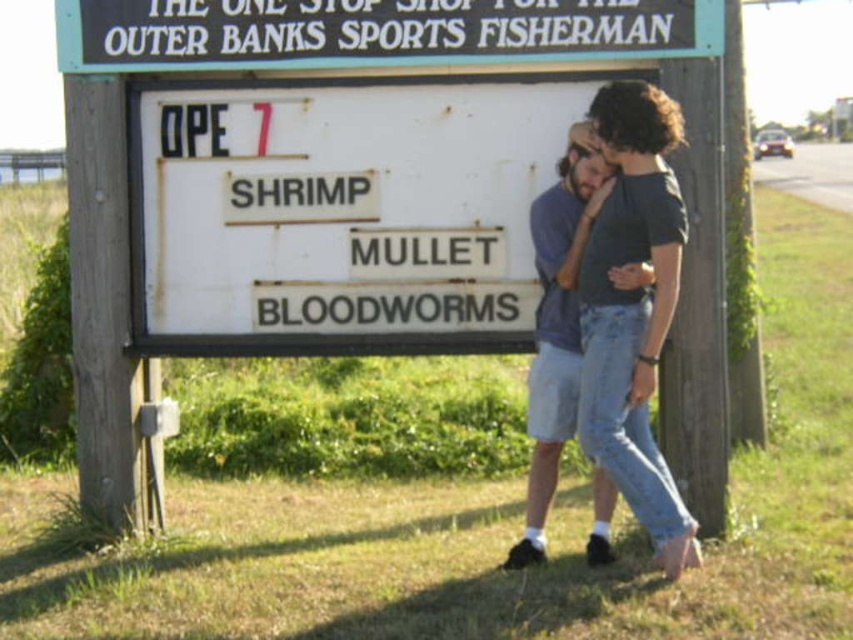
Question: Does white matte signboard at center appear on the left side of black plastic sign at upper center?

Choices:
 (A) no
 (B) yes

Answer: (B)

Question: Which point is farther to the camera?

Choices:
 (A) white matte signboard at center
 (B) denim shorts at center

Answer: (A)

Question: Which object is the closest to the black plastic sign at upper center?

Choices:
 (A) denim shorts at center
 (B) white matte signboard at center

Answer: (B)

Question: Can you confirm if black plastic sign at upper center is positioned below denim shorts at center?

Choices:
 (A) yes
 (B) no

Answer: (B)

Question: Based on their relative distances, which object is farther from the black plastic sign at upper center?

Choices:
 (A) denim shorts at center
 (B) white matte signboard at center

Answer: (A)

Question: Can you confirm if white matte signboard at center is positioned to the right of black plastic sign at upper center?

Choices:
 (A) no
 (B) yes

Answer: (A)